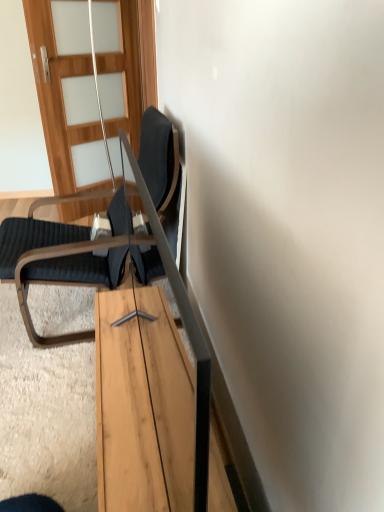
Question: Does wooden with frosted glass at upper left lie in front of light wood table at center?

Choices:
 (A) yes
 (B) no

Answer: (B)

Question: From a real-world perspective, is wooden with frosted glass at upper left located higher than light wood table at center?

Choices:
 (A) no
 (B) yes

Answer: (B)

Question: Is the position of wooden with frosted glass at upper left more distant than that of light wood table at center?

Choices:
 (A) yes
 (B) no

Answer: (A)

Question: Would you consider wooden with frosted glass at upper left to be distant from light wood table at center?

Choices:
 (A) no
 (B) yes

Answer: (B)

Question: Is wooden with frosted glass at upper left facing away from light wood table at center?

Choices:
 (A) no
 (B) yes

Answer: (A)

Question: Do you think light wood table at center is within wooden with frosted glass at upper left, or outside of it?

Choices:
 (A) inside
 (B) outside

Answer: (B)

Question: Is light wood table at center wider or thinner than wooden with frosted glass at upper left?

Choices:
 (A) wide
 (B) thin

Answer: (B)

Question: Relative to wooden with frosted glass at upper left, is light wood table at center in front or behind?

Choices:
 (A) behind
 (B) front

Answer: (B)

Question: In terms of height, does light wood table at center look taller or shorter compared to wooden with frosted glass at upper left?

Choices:
 (A) short
 (B) tall

Answer: (A)

Question: From the image's perspective, is dark gray fabric chair at left positioned above or below light wood table at center?

Choices:
 (A) below
 (B) above

Answer: (B)

Question: In terms of width, does dark gray fabric chair at left look wider or thinner when compared to light wood table at center?

Choices:
 (A) wide
 (B) thin

Answer: (A)

Question: Is dark gray fabric chair at left bigger or smaller than light wood table at center?

Choices:
 (A) small
 (B) big

Answer: (B)

Question: In the image, is dark gray fabric chair at left on the left side or the right side of light wood table at center?

Choices:
 (A) left
 (B) right

Answer: (A)

Question: Is point (96, 157) closer or farther from the camera than point (180, 382)?

Choices:
 (A) closer
 (B) farther

Answer: (B)

Question: Is wooden with frosted glass at upper left situated inside light wood table at center or outside?

Choices:
 (A) outside
 (B) inside

Answer: (A)